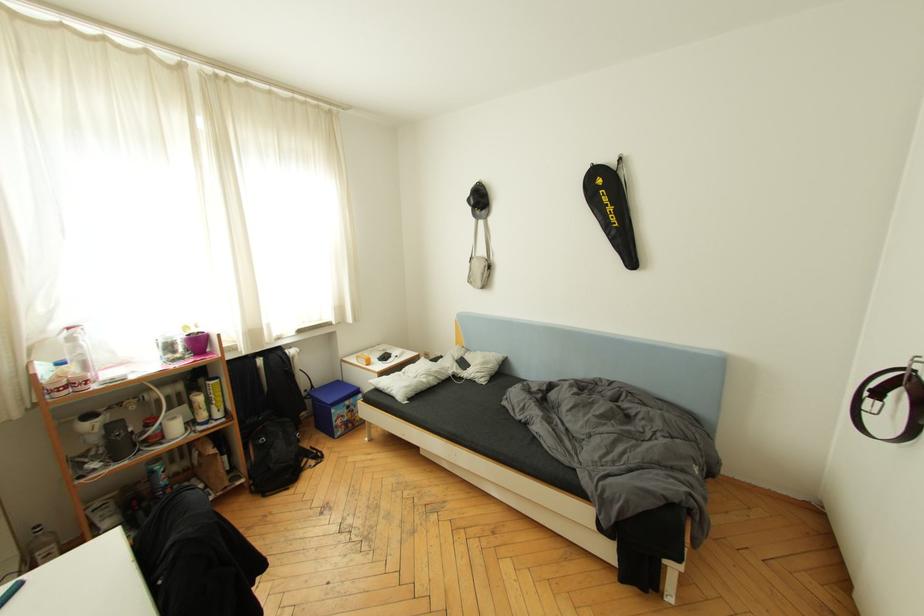
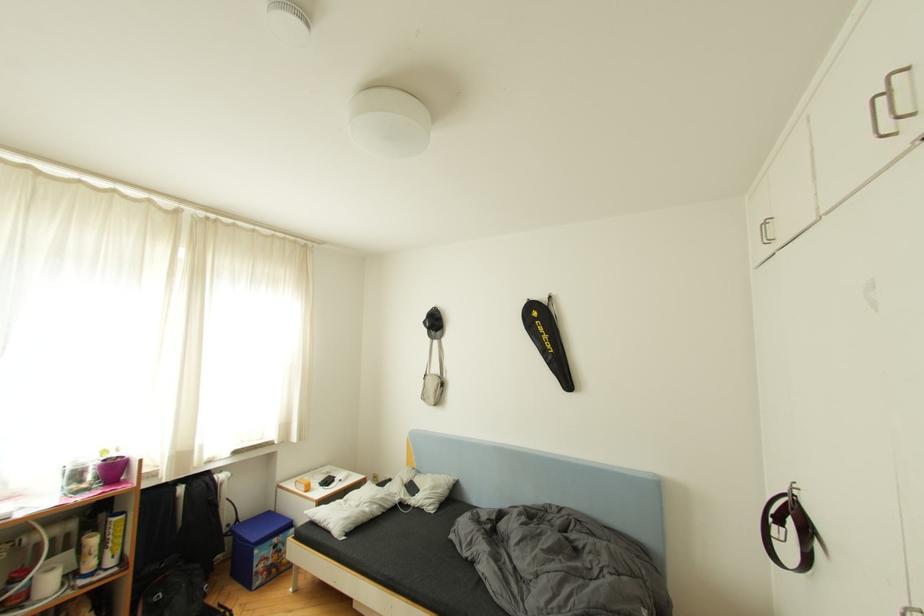
Question: How did the camera likely rotate?

Choices:
 (A) Left
 (B) Right
 (C) Up
 (D) Down

Answer: (C)